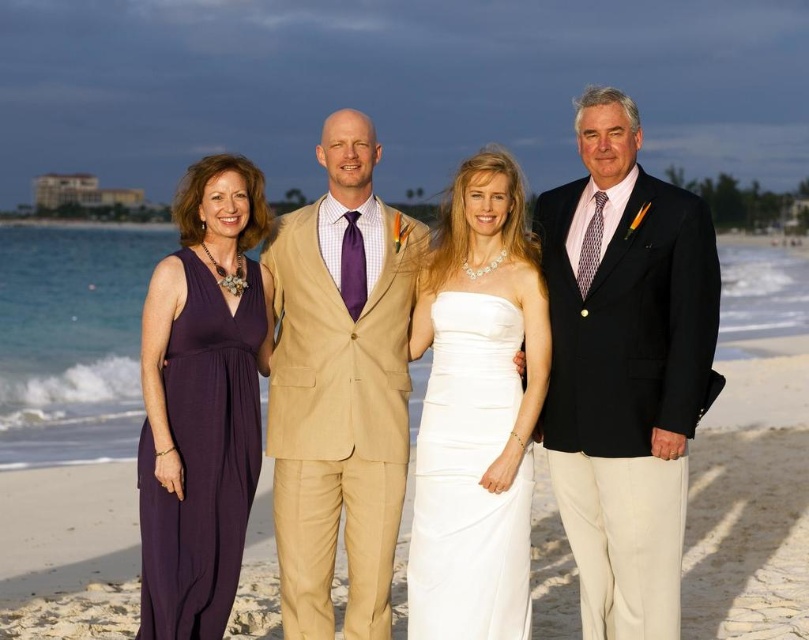
Question: Which of the following is the farthest from the observer?

Choices:
 (A) matte black suit at right
 (B) white satin dress at center
 (C) beige textured suit at center
 (D) purple silk dress at left

Answer: (C)

Question: Where is white satin dress at center located in relation to purple silk dress at left in the image?

Choices:
 (A) left
 (B) right

Answer: (B)

Question: Which of the following is the farthest from the observer?

Choices:
 (A) (454, 404)
 (B) (223, 452)
 (C) (287, 438)

Answer: (C)

Question: From the image, what is the correct spatial relationship of matte black suit at right in relation to white satin dress at center?

Choices:
 (A) above
 (B) below

Answer: (A)

Question: Which of the following is the closest to the observer?

Choices:
 (A) matte black suit at right
 (B) purple silk dress at left

Answer: (B)

Question: Is white satin dress at center above purple silk dress at left?

Choices:
 (A) yes
 (B) no

Answer: (A)